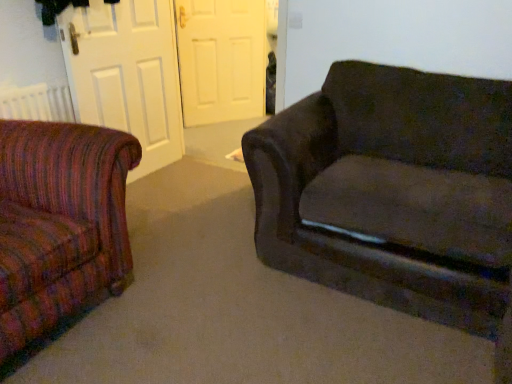
At what (x,y) coordinates should I click in order to perform the action: click on vacant space underneath dark fabric couch at right (from a real-world perspective). Please return your answer as a coordinate pair (x, y). Looking at the image, I should click on (345, 326).